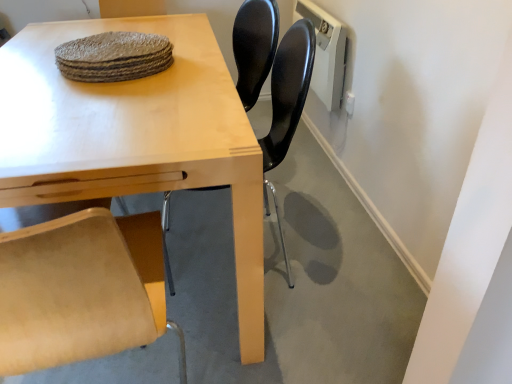
Find the location of a particular element. This screenshot has width=512, height=384. free point in front of black plastic chair at center is located at coordinates (270, 332).